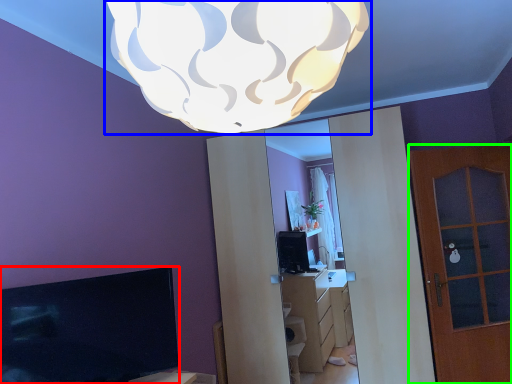
Question: Which object is the closest to the television (highlighted by a red box)? Choose among these: lamp (highlighted by a blue box) or door (highlighted by a green box).

Choices:
 (A) lamp
 (B) door

Answer: (A)